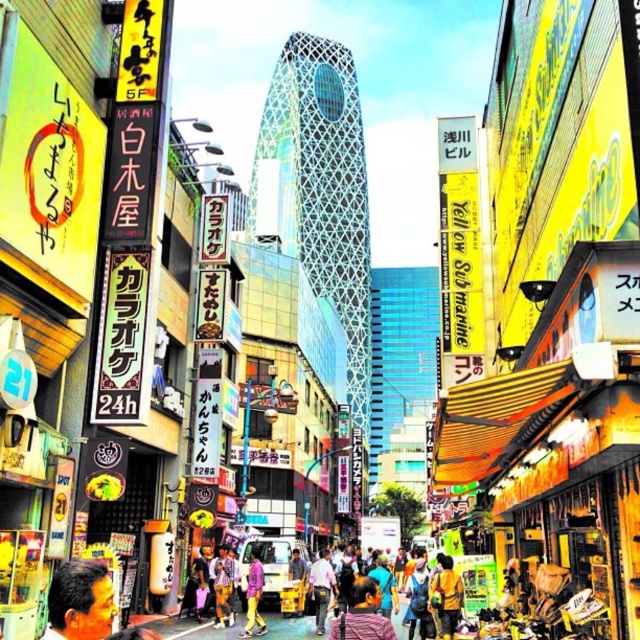
You are a photographer standing in the middle of the bustling street. You want to capture a photo of both the orange hair at center and the denim jacket at center in the same frame. Based on their sizes in the image, which object would appear larger in the photo?

The orange hair at center is much taller than the denim jacket at center, so it would appear larger in the photo.